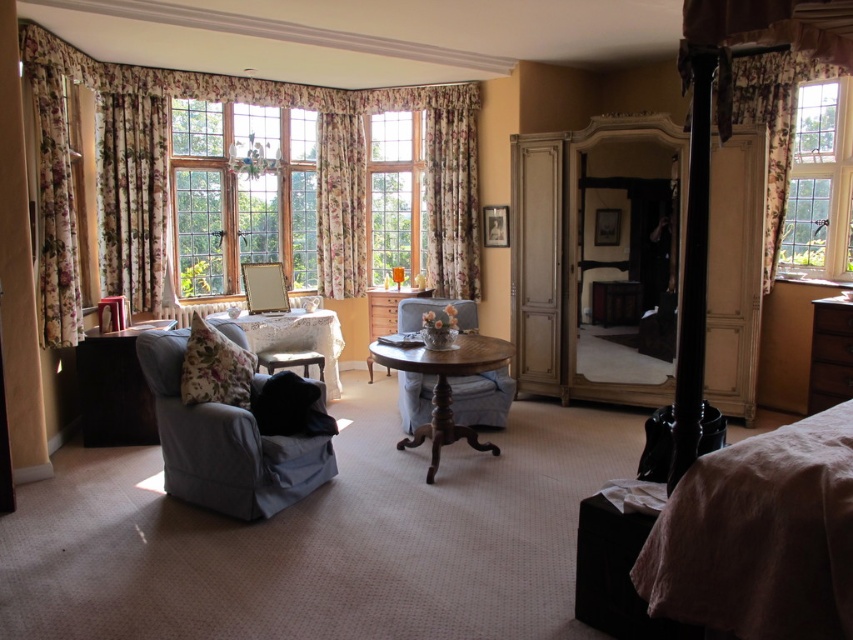
You are planning to hang a new curtain in the room. The existing floral fabric curtain at center is currently covering the window. If you want to replace it with a smaller curtain, would the brown wooden dresser at right be visible through the new curtain?

The floral fabric curtain at center has a larger size compared to brown wooden dresser at right. If the new curtain is smaller, it might not fully cover the window, potentially revealing parts of the brown wooden dresser at right depending on placement.

You are a delivery person who needs to place a 4 meter long sofa in this room. The sofa has to be placed between the floral fabric curtain at center and the brown wooden dresser at right. Is there enough space between them to fit the sofa?

The distance between the floral fabric curtain at center and the brown wooden dresser at right is 4.17 meters. Since the sofa is 4 meters long, there is enough space to place it between them as the distance is slightly longer than the sofa.

You are planning to replace the floral fabric curtain at center with a new one that is the same size. Given that the velvet blue armchair at center is currently occupying space near the curtain, will the new curtain fit in the same spot without needing to move the armchair?

The floral fabric curtain at center is larger in size than the velvet blue armchair at center. Since the new curtain is the same size as the original, it will require the same amount of space. Therefore, the velvet blue armchair at center may obstruct the curtain if it is positioned too close. To ensure proper installation, the armchair should be moved temporarily to accommodate the curtain.